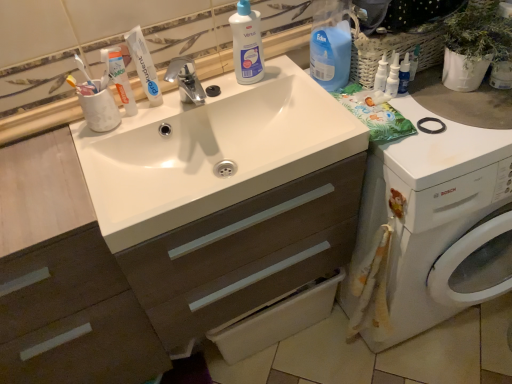
Where is `free space to the left of white glossy bottle at upper center, marked as the first cleaning product in a left-to-right arrangement`? free space to the left of white glossy bottle at upper center, marked as the first cleaning product in a left-to-right arrangement is located at coordinates (209, 94).